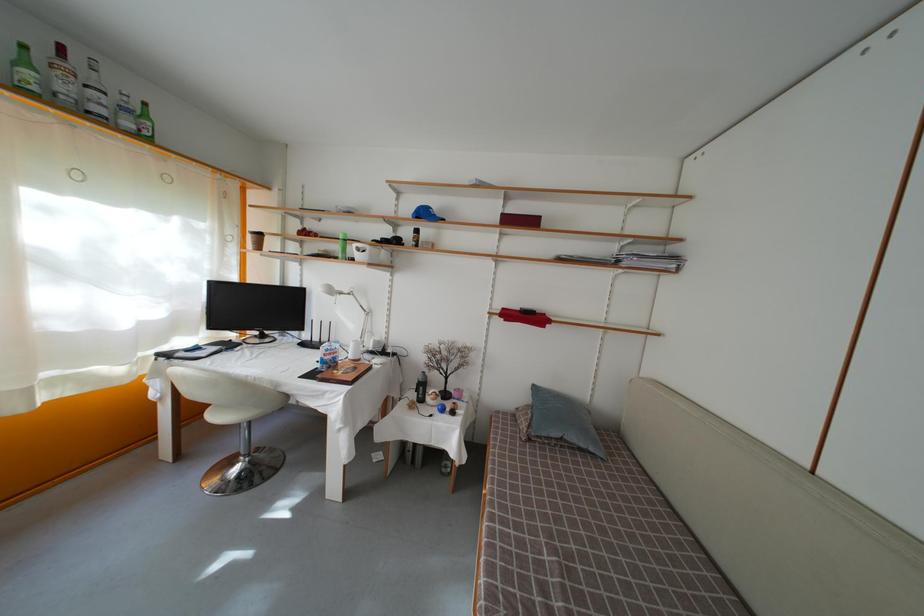
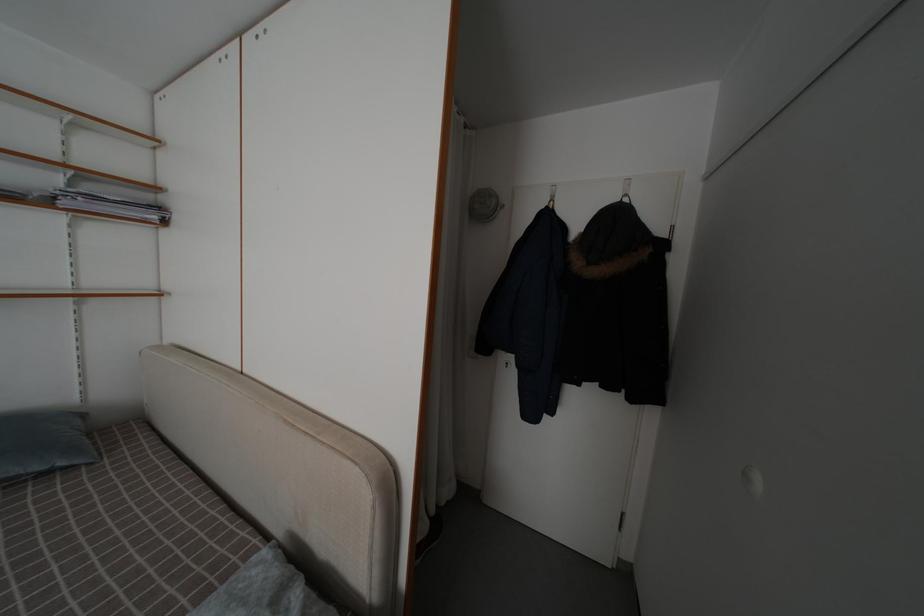
Question: Based on the continuous images, in which direction is the camera rotating? Reply with the corresponding letter.

Choices:
 (A) Left
 (B) Right
 (C) Up
 (D) Down

Answer: (B)